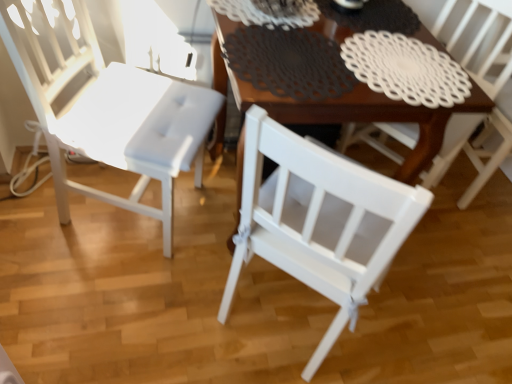
Question: Does white matte chair at left, the 2th chair when ordered from right to left, have a smaller size compared to wooden table at center?

Choices:
 (A) yes
 (B) no

Answer: (A)

Question: From a real-world perspective, is white matte chair at left, the 2th chair when ordered from right to left, physically below wooden table at center?

Choices:
 (A) yes
 (B) no

Answer: (B)

Question: Is wooden table at center at the back of white matte chair at left, the 2th chair when ordered from right to left?

Choices:
 (A) no
 (B) yes

Answer: (A)

Question: Is the depth of white matte chair at left, the 2th chair when ordered from right to left, less than that of wooden table at center?

Choices:
 (A) yes
 (B) no

Answer: (A)

Question: Considering the positions of point (501, 44) and point (33, 34), is point (501, 44) closer or farther from the camera than point (33, 34)?

Choices:
 (A) closer
 (B) farther

Answer: (B)

Question: Considering the positions of white matte chair at center, the first chair when ordered from right to left, and white matte chair at left, marked as the 1th chair in a left-to-right arrangement, in the image, is white matte chair at center, the first chair when ordered from right to left, wider or thinner than white matte chair at left, marked as the 1th chair in a left-to-right arrangement,?

Choices:
 (A) wide
 (B) thin

Answer: (A)

Question: Is white matte chair at center, which is the 2th chair from left to right, to the left or to the right of white matte chair at left, the 2th chair when ordered from right to left, in the image?

Choices:
 (A) left
 (B) right

Answer: (B)

Question: In the image, is white matte chair at center, the first chair when ordered from right to left, positioned in front of or behind white matte chair at left, the 2th chair when ordered from right to left?

Choices:
 (A) behind
 (B) front

Answer: (A)

Question: Is wooden table at center taller or shorter than white matte chair at left, marked as the 1th chair in a left-to-right arrangement?

Choices:
 (A) tall
 (B) short

Answer: (B)

Question: Relative to white matte chair at left, marked as the 1th chair in a left-to-right arrangement, is wooden table at center in front or behind?

Choices:
 (A) front
 (B) behind

Answer: (B)

Question: Is point (227, 72) closer or farther from the camera than point (5, 23)?

Choices:
 (A) closer
 (B) farther

Answer: (B)

Question: From the image's perspective, is wooden table at center above or below white matte chair at left, marked as the 1th chair in a left-to-right arrangement?

Choices:
 (A) above
 (B) below

Answer: (B)

Question: Considering their positions, is wooden table at center located in front of or behind white matte chair at center, which is the 2th chair from left to right?

Choices:
 (A) front
 (B) behind

Answer: (A)

Question: Is wooden table at center to the left or to the right of white matte chair at center, which is the 2th chair from left to right, in the image?

Choices:
 (A) right
 (B) left

Answer: (B)